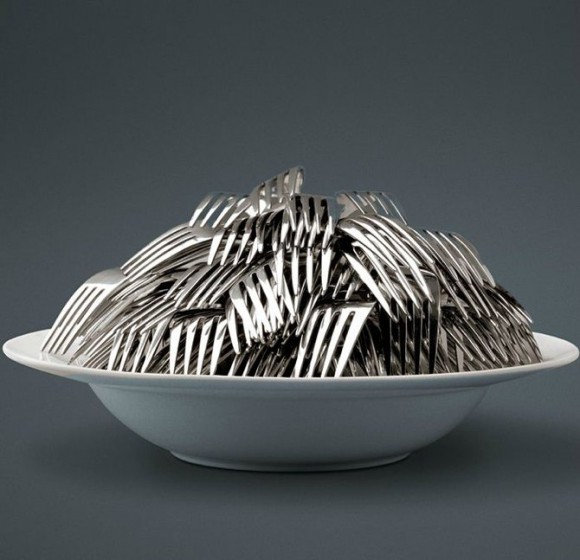
Image resolution: width=580 pixels, height=560 pixels. In order to click on left edge of bowl in this screenshot , I will do `click(2, 348)`.